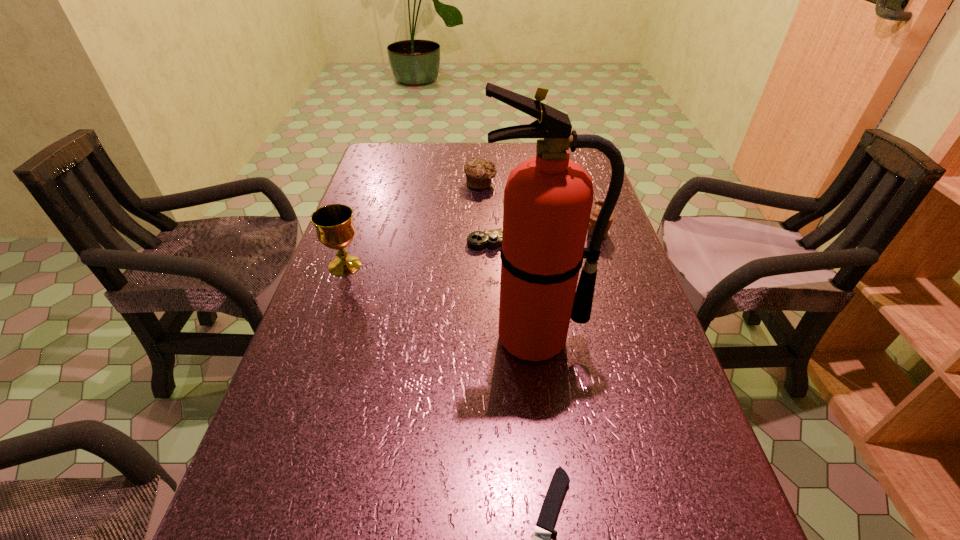
I want to click on the tallest object, so click(548, 199).

Identify the location of fire extinguisher. (548, 199).

At what (x,y) coordinates should I click in order to perform the action: click on the second tallest object. Please return your answer as a coordinate pair (x, y). The width and height of the screenshot is (960, 540). Looking at the image, I should click on (334, 225).

Identify the location of the leftmost object. [334, 225].

At what (x,y) coordinates should I click in order to perform the action: click on the taller muffin. Please return your answer as a coordinate pair (x, y). This screenshot has width=960, height=540. Looking at the image, I should click on (598, 204).

At what (x,y) coordinates should I click in order to perform the action: click on the nearer muffin. Please return your answer as a coordinate pair (x, y). The height and width of the screenshot is (540, 960). Looking at the image, I should click on (598, 204).

Where is `the third shortest object`? the third shortest object is located at coordinates (479, 173).

Image resolution: width=960 pixels, height=540 pixels. In order to click on the shorter muffin in this screenshot , I will do `click(479, 173)`.

You are a GUI agent. You are given a task and a screenshot of the screen. Output one action in this format:
    pyautogui.click(x=<x>, y=<y>)
    Task: Click on the control
    
    Given the screenshot: What is the action you would take?
    pyautogui.click(x=492, y=239)

This screenshot has height=540, width=960. In order to click on vacant space located 0.070m at the nozzle of the second nearest object in this screenshot , I will do `click(542, 396)`.